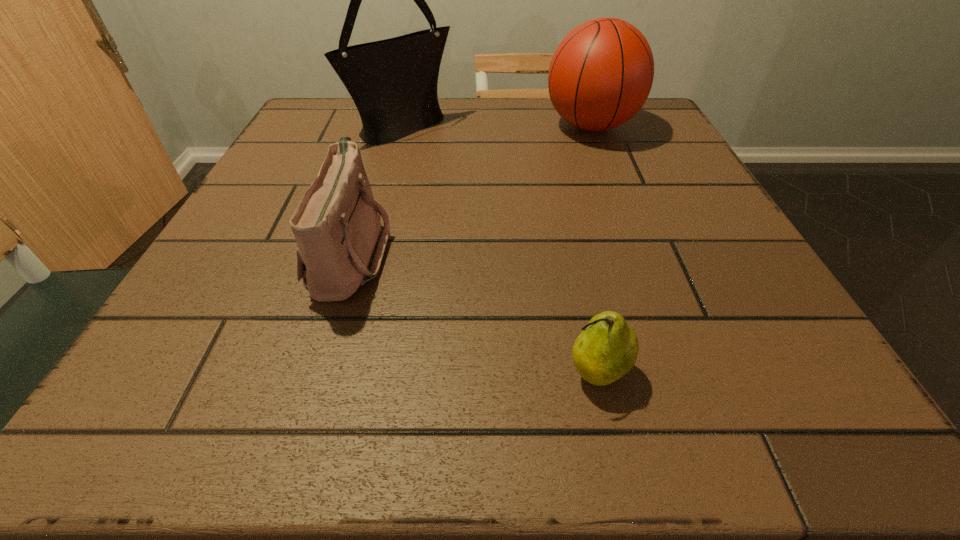
At what (x,y) coordinates should I click in order to perform the action: click on the tallest object. Please return your answer as a coordinate pair (x, y). This screenshot has height=540, width=960. Looking at the image, I should click on (393, 82).

The width and height of the screenshot is (960, 540). What are the coordinates of `the farther shoulder bag` in the screenshot? It's located at (393, 82).

Identify the location of the second tallest object. (601, 74).

The image size is (960, 540). What are the coordinates of `the third tallest object` in the screenshot? It's located at (340, 245).

Find the location of a particular element. Image resolution: width=960 pixels, height=540 pixels. the nearer shoulder bag is located at coordinates (340, 245).

Identify the location of the shortest object. Image resolution: width=960 pixels, height=540 pixels. (607, 349).

Locate an element on the screen. The image size is (960, 540). pear is located at coordinates (607, 349).

This screenshot has height=540, width=960. In order to click on vacant space situated on the right of the tallest object in this screenshot , I will do `click(611, 128)`.

You are a GUI agent. You are given a task and a screenshot of the screen. Output one action in this format:
    pyautogui.click(x=<x>, y=<y>)
    Task: Click on the vacant area located 0.100m on the left of the second tallest object
    
    Given the screenshot: What is the action you would take?
    pyautogui.click(x=499, y=126)

I want to click on vacant space situated on the front pocket of the shorter shoulder bag, so click(432, 252).